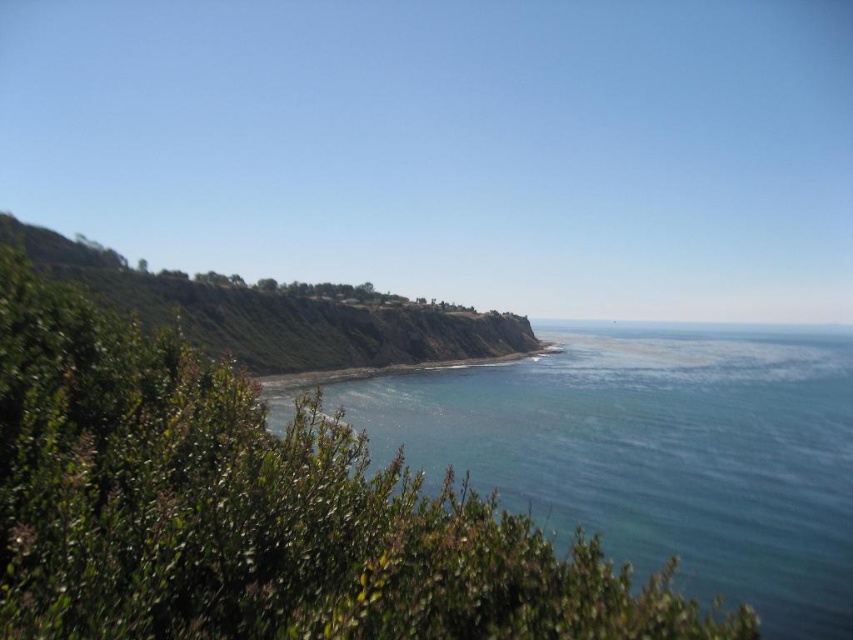
You are standing on the cliff overlooking the blue smooth water at center and the green grassy shoreline at center. Which of these two features is higher in elevation?

The blue smooth water at center is taller than the green grassy shoreline at center, meaning it has a higher elevation.

You are standing on the cliff overlooking the blue smooth water at center and the green grassy shoreline at center. Which area has a wider view from where you are standing?

The blue smooth water at center has a wider view from where you are standing because its width is larger than the green grassy shoreline at center.

You are a photographer trying to capture the entire coastal landscape. You notice the blue smooth water at center and the green grassy shoreline at center. Which of these two elements takes up more space in the image?

The blue smooth water at center takes up more space in the image as it is bigger than the green grassy shoreline at center.